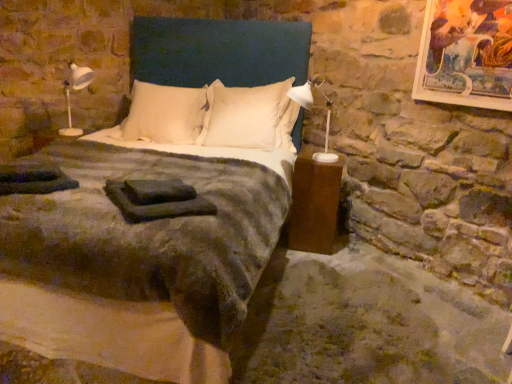
Question: Does white soft pillow at center, the 1th pillow in the left-to-right sequence, appear on the right side of dark green fabric at center?

Choices:
 (A) yes
 (B) no

Answer: (B)

Question: Is white soft pillow at center, marked as the 2th pillow in a right-to-left arrangement, smaller than dark green fabric at center?

Choices:
 (A) yes
 (B) no

Answer: (B)

Question: From the image's perspective, does white soft pillow at center, the 1th pillow in the left-to-right sequence, appear lower than dark green fabric at center?

Choices:
 (A) no
 (B) yes

Answer: (A)

Question: Is white soft pillow at center, marked as the 2th pillow in a right-to-left arrangement, facing away from dark green fabric at center?

Choices:
 (A) yes
 (B) no

Answer: (B)

Question: From the image's perspective, is white soft pillow at center, the 1th pillow in the left-to-right sequence, above dark green fabric at center?

Choices:
 (A) yes
 (B) no

Answer: (A)

Question: Looking at the image, does white plastic lamp at right, the 2th bedside lamp from the left, seem bigger or smaller compared to dark green fabric at center?

Choices:
 (A) big
 (B) small

Answer: (A)

Question: From a real-world perspective, relative to dark green fabric at center, is white plastic lamp at right, the 2th bedside lamp from the left, vertically above or below?

Choices:
 (A) above
 (B) below

Answer: (A)

Question: Is white plastic lamp at right, the 2th bedside lamp from the left, in front of or behind dark green fabric at center in the image?

Choices:
 (A) behind
 (B) front

Answer: (A)

Question: Based on their positions, is white plastic lamp at right, the 1th bedside lamp when ordered from right to left, located to the left or right of dark green fabric at center?

Choices:
 (A) left
 (B) right

Answer: (B)

Question: From a real-world perspective, relative to white soft pillow at center, marked as the 1th pillow in a right-to-left arrangement, is velvet dark green bed at center vertically above or below?

Choices:
 (A) above
 (B) below

Answer: (B)

Question: From the image's perspective, is velvet dark green bed at center positioned above or below white soft pillow at center, which is the 2th pillow in left-to-right order?

Choices:
 (A) above
 (B) below

Answer: (B)

Question: Considering the positions of point (83, 238) and point (210, 97), is point (83, 238) closer or farther from the camera than point (210, 97)?

Choices:
 (A) farther
 (B) closer

Answer: (B)

Question: Considering the positions of velvet dark green bed at center and white soft pillow at center, marked as the 1th pillow in a right-to-left arrangement, in the image, is velvet dark green bed at center taller or shorter than white soft pillow at center, marked as the 1th pillow in a right-to-left arrangement,?

Choices:
 (A) tall
 (B) short

Answer: (A)

Question: Considering the positions of dark green fabric at center and metallic gold picture frame at upper right in the image, is dark green fabric at center wider or thinner than metallic gold picture frame at upper right?

Choices:
 (A) wide
 (B) thin

Answer: (A)

Question: From a real-world perspective, relative to metallic gold picture frame at upper right, is dark green fabric at center vertically above or below?

Choices:
 (A) above
 (B) below

Answer: (B)